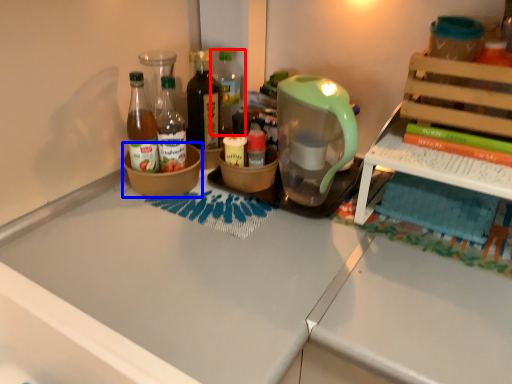
Question: Which object appears farthest to the camera in this image, bottle (highlighted by a red box) or bowl (highlighted by a blue box)?

Choices:
 (A) bottle
 (B) bowl

Answer: (A)